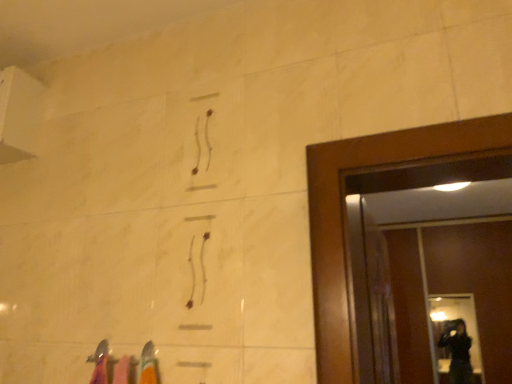
Question: Is transparent glass screen door at right facing away from transparent glass door at right?

Choices:
 (A) no
 (B) yes

Answer: (B)

Question: Is transparent glass screen door at right to the left of transparent glass door at right from the viewer's perspective?

Choices:
 (A) yes
 (B) no

Answer: (B)

Question: Is transparent glass screen door at right further to camera compared to transparent glass door at right?

Choices:
 (A) no
 (B) yes

Answer: (A)

Question: Is transparent glass screen door at right taller than transparent glass door at right?

Choices:
 (A) yes
 (B) no

Answer: (A)

Question: Is transparent glass screen door at right oriented towards transparent glass door at right?

Choices:
 (A) no
 (B) yes

Answer: (B)

Question: Considering the relative sizes of transparent glass screen door at right and transparent glass door at right in the image provided, is transparent glass screen door at right bigger than transparent glass door at right?

Choices:
 (A) no
 (B) yes

Answer: (B)

Question: Is transparent glass door at right not inside transparent glass screen door at right?

Choices:
 (A) yes
 (B) no

Answer: (B)

Question: Is transparent glass screen door at right surrounded by transparent glass door at right?

Choices:
 (A) yes
 (B) no

Answer: (B)

Question: From a real-world perspective, is transparent glass door at right physically above transparent glass screen door at right?

Choices:
 (A) yes
 (B) no

Answer: (B)

Question: Does transparent glass door at right have a larger size compared to transparent glass screen door at right?

Choices:
 (A) no
 (B) yes

Answer: (A)

Question: Is transparent glass door at right at the left side of transparent glass screen door at right?

Choices:
 (A) yes
 (B) no

Answer: (A)

Question: Is transparent glass door at right touching transparent glass screen door at right?

Choices:
 (A) no
 (B) yes

Answer: (A)

Question: Which is correct: transparent glass door at right is inside transparent glass screen door at right, or outside of it?

Choices:
 (A) inside
 (B) outside

Answer: (A)